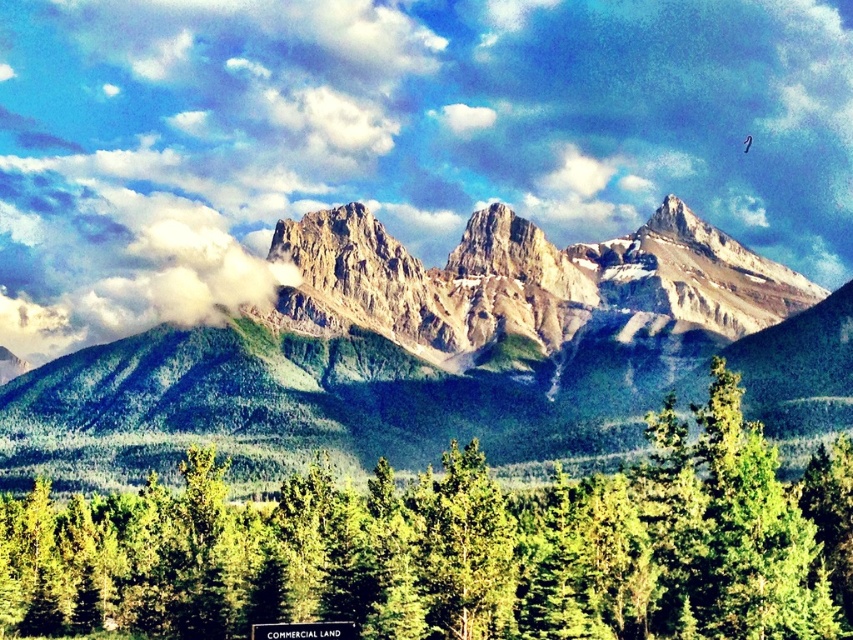
Question: Which point is farther to the camera?

Choices:
 (A) (537, 253)
 (B) (755, 586)
 (C) (799, 100)

Answer: (C)

Question: Is white fluffy cloud at upper center to the right of rugged stone mountain range at center from the viewer's perspective?

Choices:
 (A) no
 (B) yes

Answer: (A)

Question: Which of the following is the farthest from the observer?

Choices:
 (A) (135, 525)
 (B) (97, 141)
 (C) (9, 449)

Answer: (B)

Question: Considering the relative positions of rugged stone mountain range at center and green matte pine forest at lower center in the image provided, where is rugged stone mountain range at center located with respect to green matte pine forest at lower center?

Choices:
 (A) right
 (B) left

Answer: (A)

Question: Is white fluffy cloud at upper center below green matte pine forest at lower center?

Choices:
 (A) no
 (B) yes

Answer: (A)

Question: Which is farther from the white fluffy cloud at upper center?

Choices:
 (A) rugged stone mountain range at center
 (B) green matte pine forest at lower center

Answer: (B)